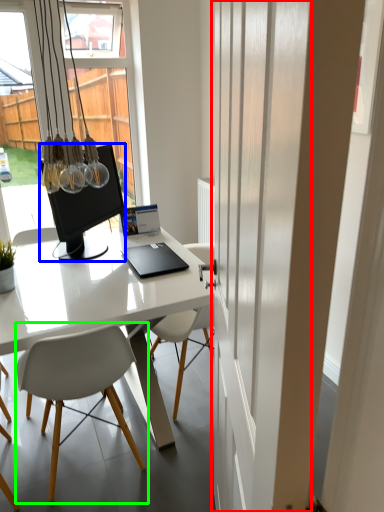
Question: Estimate the real-world distances between objects in this image. Which object is farther from screen door (highlighted by a red box), television (highlighted by a blue box) or chair (highlighted by a green box)?

Choices:
 (A) television
 (B) chair

Answer: (A)